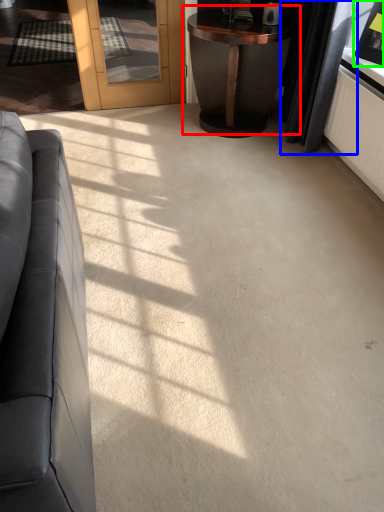
Question: Which is nearer to the table (highlighted by a red box)? curtain (highlighted by a blue box) or picture frame (highlighted by a green box).

Choices:
 (A) curtain
 (B) picture frame

Answer: (A)